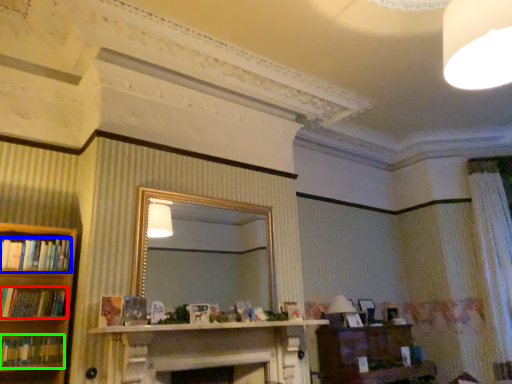
Question: Which object is the farthest from book (highlighted by a red box)? Choose among these: book (highlighted by a blue box) or book (highlighted by a green box).

Choices:
 (A) book
 (B) book

Answer: (A)